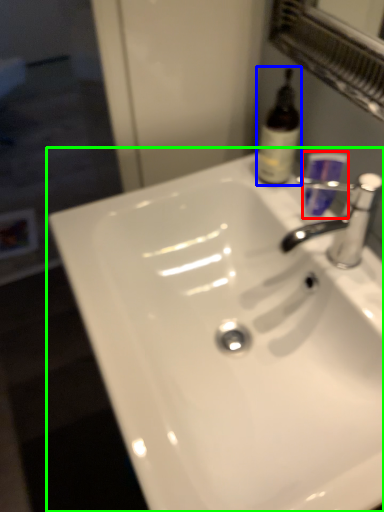
Question: Which object is the farthest from mouthwash (highlighted by a red box)? Choose among these: bottle (highlighted by a blue box) or sink (highlighted by a green box).

Choices:
 (A) bottle
 (B) sink

Answer: (B)